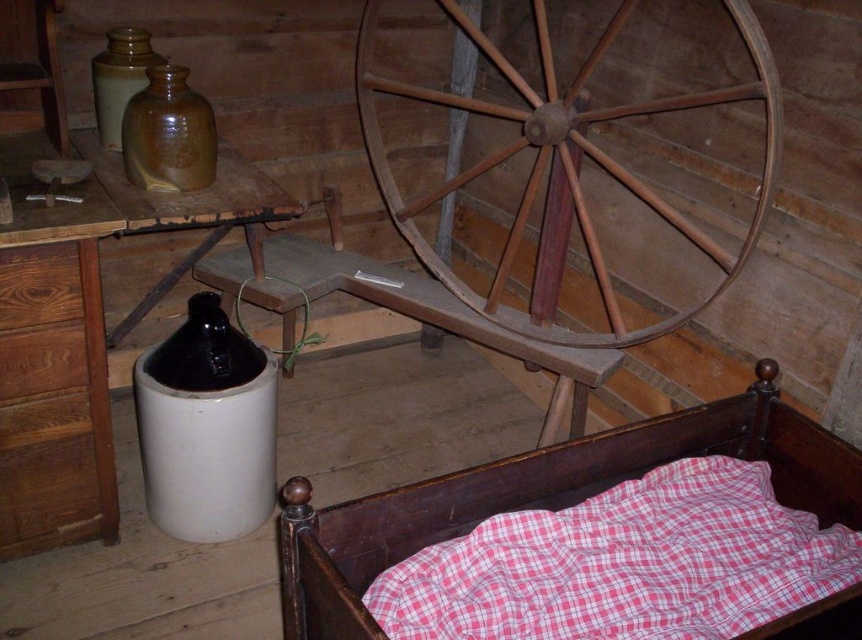
You are an interior designer planning to move the wooden wagon wheel at center to the left wall. However, there is a wooden bed frame at lower right in the way. Can you move the wagon wheel without moving the bed frame?

The wooden bed frame at lower right is positioned under the wooden wagon wheel at center, so moving the wagon wheel to the left wall would require lifting it over the bed frame since it is blocking the path.

You are standing in the room and want to walk from point A to point B. Point A is at coordinates point (378, 536) and point B is at coordinates point (625, 176). Which direction should you face to move towards point B from point A?

You should face towards the upper left direction to move from point A to point B since point B is located at a higher y coordinate and lower x coordinate compared to point A.